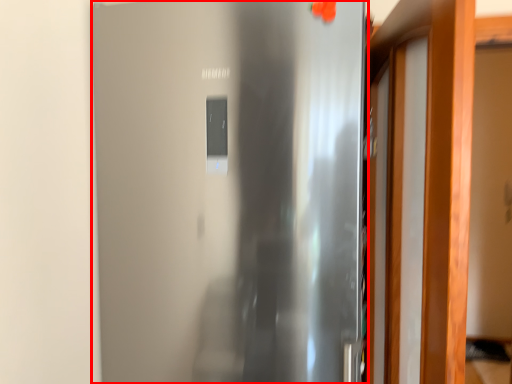
Question: Considering the relative positions of door (annotated by the red box) and door in the image provided, where is door (annotated by the red box) located with respect to the staircase?

Choices:
 (A) right
 (B) left

Answer: (B)